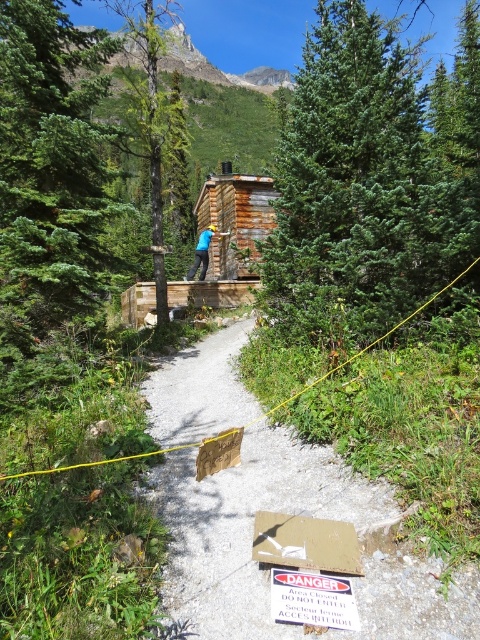
Question: Which point appears closest to the camera in this image?

Choices:
 (A) (229, 385)
 (B) (155, 232)
 (C) (332, 618)

Answer: (C)

Question: Is rustic wooden cabin at center above blue cotton shirt at center?

Choices:
 (A) yes
 (B) no

Answer: (A)

Question: Among these points, which one is farthest from the camera?

Choices:
 (A) (151, 45)
 (B) (203, 522)
 (C) (219, 200)
 (D) (316, 234)

Answer: (C)

Question: Is green fir tree at center to the right of white cardboard sign at center from the viewer's perspective?

Choices:
 (A) yes
 (B) no

Answer: (A)

Question: Estimate the real-world distances between objects in this image. Which object is farther from the gravel path at center?

Choices:
 (A) dark brown bark tree at center
 (B) white cardboard sign at center
 (C) rustic wooden cabin at center
 (D) blue cotton shirt at center

Answer: (A)

Question: Does green fir tree at center appear on the right side of rustic wooden cabin at center?

Choices:
 (A) no
 (B) yes

Answer: (B)